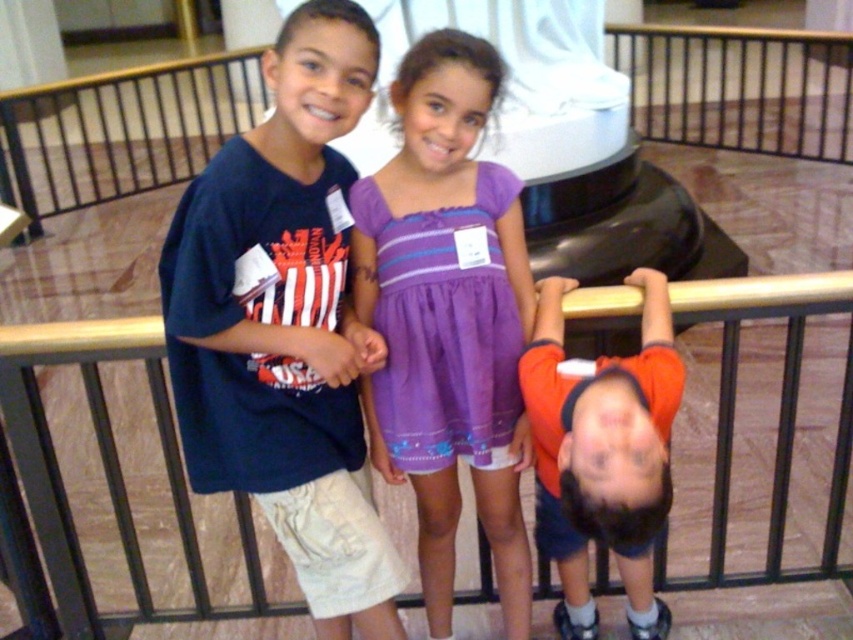
Question: Estimate the real-world distances between objects in this image. Which object is farther from the orange fabric shirt at lower right?

Choices:
 (A) purple cotton dress at center
 (B) gold metal railing at upper center
 (C) dark blue t-shirt at upper left
 (D) black metal railing at upper center

Answer: (D)

Question: Is purple cotton dress at center above black metal railing at upper center?

Choices:
 (A) yes
 (B) no

Answer: (B)

Question: In this image, where is purple cotton dress at center located relative to orange fabric shirt at lower right?

Choices:
 (A) right
 (B) left

Answer: (B)

Question: Which of these objects is positioned closest to the dark blue t-shirt at upper left?

Choices:
 (A) orange fabric shirt at lower right
 (B) purple cotton dress at center
 (C) black metal railing at upper center
 (D) gold metal railing at upper center

Answer: (B)

Question: Which of the following is the farthest from the observer?

Choices:
 (A) orange fabric shirt at lower right
 (B) black metal railing at upper center

Answer: (B)

Question: Is dark blue t-shirt at upper left smaller than black metal railing at upper center?

Choices:
 (A) yes
 (B) no

Answer: (A)